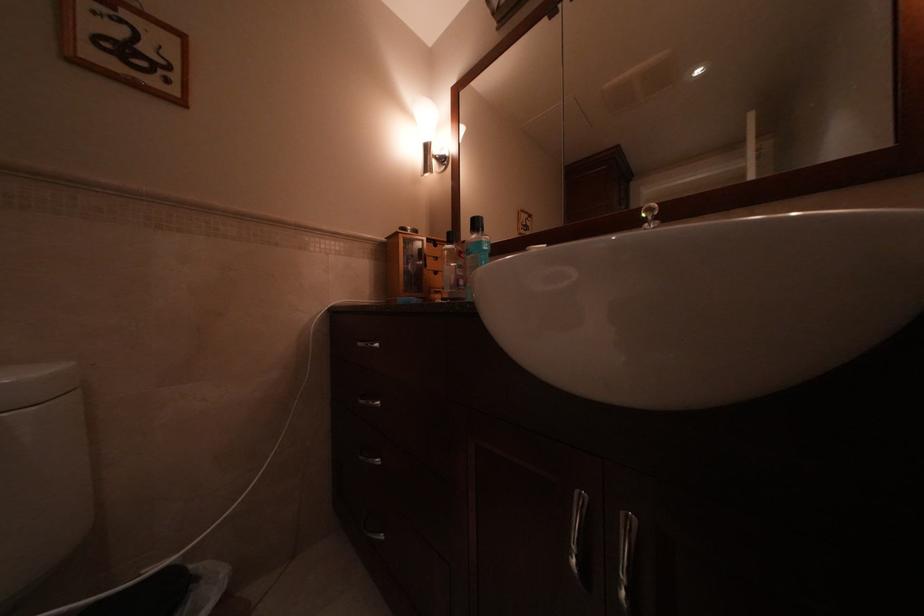
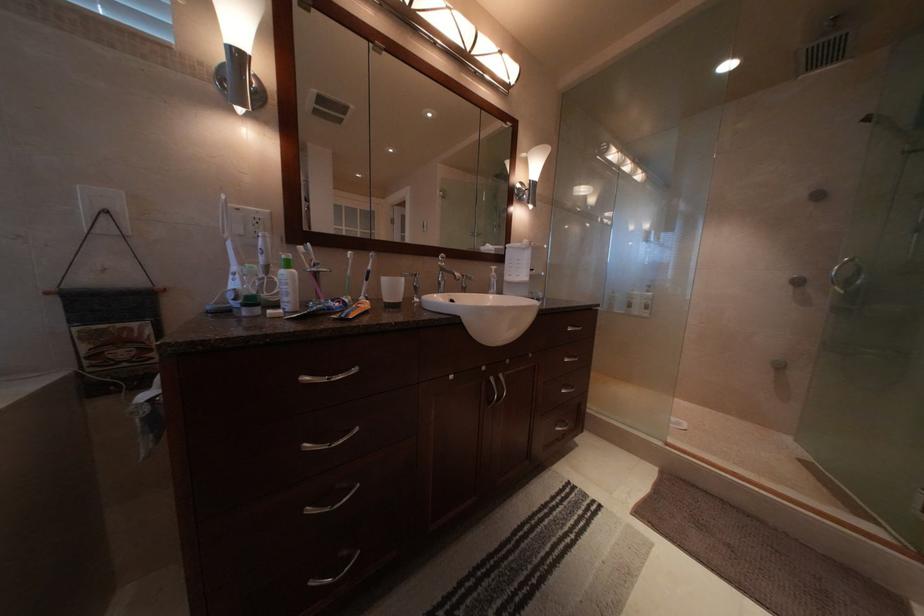
What movement of the cameraman would produce the second image?

The cameraman walked toward left, backward.